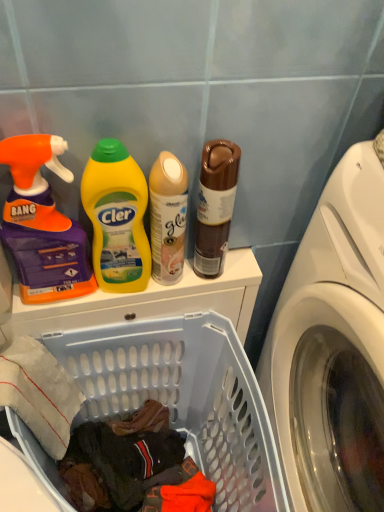
Question: Is brown matte can at upper center located within white glossy washing machine at right?

Choices:
 (A) yes
 (B) no

Answer: (B)

Question: From the image's perspective, is white glossy washing machine at right located above brown matte can at upper center?

Choices:
 (A) yes
 (B) no

Answer: (B)

Question: Is white glossy washing machine at right not near brown matte can at upper center?

Choices:
 (A) no
 (B) yes

Answer: (A)

Question: Can you see white glossy washing machine at right touching brown matte can at upper center?

Choices:
 (A) yes
 (B) no

Answer: (B)

Question: From the image's perspective, is white glossy washing machine at right located beneath brown matte can at upper center?

Choices:
 (A) yes
 (B) no

Answer: (A)

Question: From a real-world perspective, does white glossy washing machine at right sit lower than brown matte can at upper center?

Choices:
 (A) no
 (B) yes

Answer: (B)

Question: Can you confirm if brown matte can at upper center is thinner than matte beige spray can at center, placed as the 3th cleaning product when sorted from left to right?

Choices:
 (A) no
 (B) yes

Answer: (A)

Question: From a real-world perspective, is brown matte can at upper center physically below matte beige spray can at center, acting as the 1th cleaning product starting from the right?

Choices:
 (A) no
 (B) yes

Answer: (A)

Question: Is brown matte can at upper center to the left of matte beige spray can at center, placed as the 3th cleaning product when sorted from left to right, from the viewer's perspective?

Choices:
 (A) no
 (B) yes

Answer: (A)

Question: From a real-world perspective, is brown matte can at upper center positioned over matte beige spray can at center, placed as the 3th cleaning product when sorted from left to right, based on gravity?

Choices:
 (A) yes
 (B) no

Answer: (A)

Question: Is brown matte can at upper center outside of matte beige spray can at center, acting as the 1th cleaning product starting from the right?

Choices:
 (A) yes
 (B) no

Answer: (A)

Question: Can you confirm if brown matte can at upper center is smaller than matte beige spray can at center, placed as the 3th cleaning product when sorted from left to right?

Choices:
 (A) no
 (B) yes

Answer: (A)

Question: Is orange matte spray bottle at left, the 3th cleaning product viewed from the right, facing towards translucent plastic laundry basket at lower left?

Choices:
 (A) no
 (B) yes

Answer: (A)